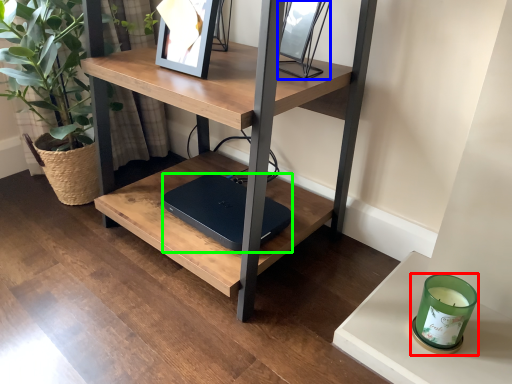
Question: Which object is positioned closest to candle holder (highlighted by a red box)? Select from picture frame (highlighted by a blue box) and laptop (highlighted by a green box).

Choices:
 (A) picture frame
 (B) laptop

Answer: (B)